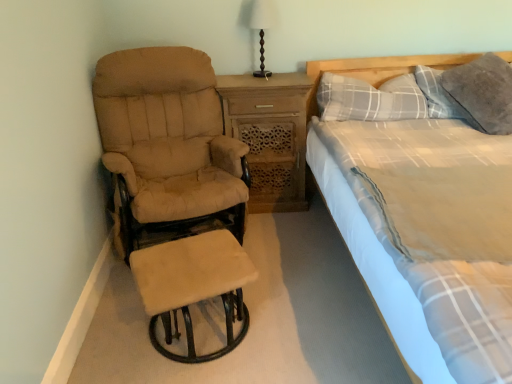
Where is `vacant area to the right of matte brown wooden lamp at upper center`? vacant area to the right of matte brown wooden lamp at upper center is located at coordinates (290, 77).